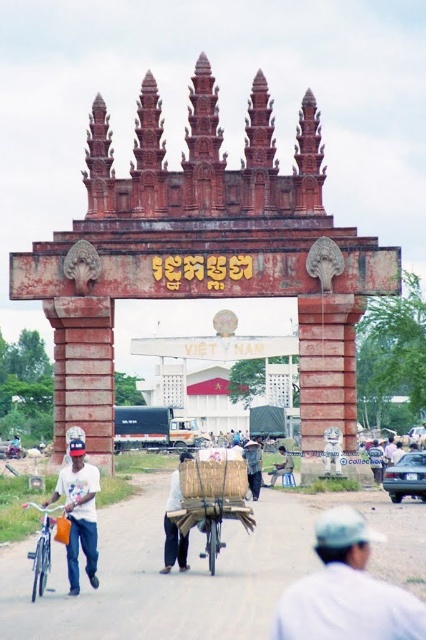
Question: Estimate the real-world distances between objects in this image. Which object is farther from the white woven basket at center?

Choices:
 (A) denim pants at center
 (B) white matte shirt at center
 (C) white cloth hat at lower right
 (D) silver metallic bicycle at left

Answer: (C)

Question: Considering the real-world distances, which object is closest to the white woven basket at center?

Choices:
 (A) denim pants at center
 (B) blue denim pants at center

Answer: (A)

Question: Observing the image, what is the correct spatial positioning of white cloth hat at lower right in reference to denim pants at center?

Choices:
 (A) right
 (B) left

Answer: (A)

Question: Can you confirm if white matte shirt at center is bigger than silver metallic bicycle at left?

Choices:
 (A) no
 (B) yes

Answer: (B)

Question: Among these objects, which one is farthest from the camera?

Choices:
 (A) white woven basket at center
 (B) silver metallic bicycle at left
 (C) blue denim pants at center

Answer: (C)

Question: Considering the relative positions of bamboo basket at center and denim pants at center in the image provided, where is bamboo basket at center located with respect to denim pants at center?

Choices:
 (A) left
 (B) right

Answer: (A)